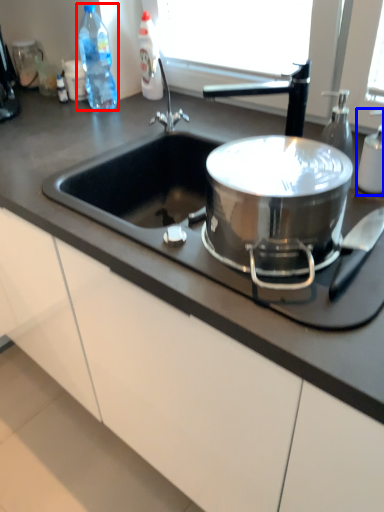
Question: Which of the following is the farthest to the observer, bottle (highlighted by a red box) or bottle (highlighted by a blue box)?

Choices:
 (A) bottle
 (B) bottle

Answer: (A)